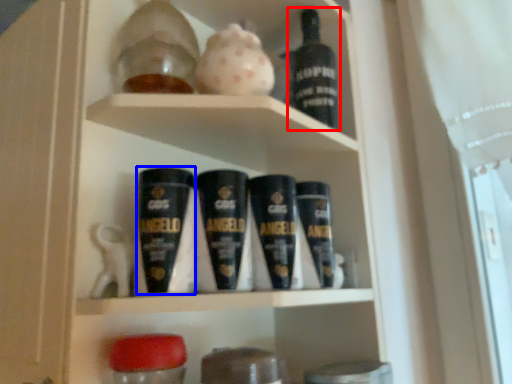
Question: Among these objects, which one is farthest to the camera, bottle (highlighted by a red box) or shaving cream (highlighted by a blue box)?

Choices:
 (A) bottle
 (B) shaving cream

Answer: (A)